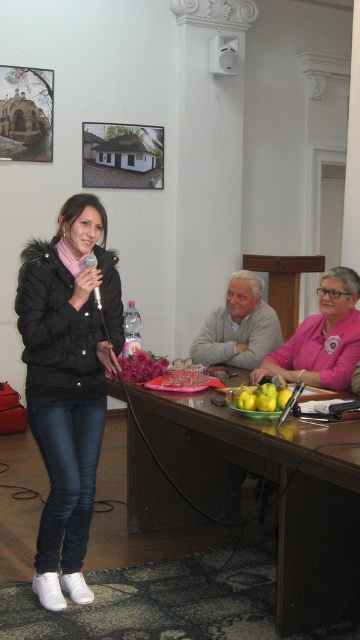
In the scene shown: Can you confirm if gray woolen sweater at center is positioned above white glossy speaker at upper center?

No.

Is point (261, 339) farther from camera compared to point (235, 36)?

No, it is in front of (235, 36).

Locate an element on the screen. The image size is (360, 640). gray woolen sweater at center is located at coordinates (239, 326).

Looking at this image, is pink fabric at center to the left of matte black microphone at center from the viewer's perspective?

No, pink fabric at center is not to the left of matte black microphone at center.

Is pink fabric at center shorter than matte black microphone at center?

In fact, pink fabric at center may be taller than matte black microphone at center.

Is point (315, 336) in front of point (97, 285)?

That is False.

I want to click on pink fabric at center, so click(321, 337).

Does brown wooden table at center lie behind white glossy speaker at upper center?

No.

Is brown wooden table at center thinner than white glossy speaker at upper center?

Incorrect, brown wooden table at center's width is not less than white glossy speaker at upper center's.

This screenshot has height=640, width=360. What do you see at coordinates (279, 490) in the screenshot?
I see `brown wooden table at center` at bounding box center [279, 490].

Locate an element on the screen. brown wooden table at center is located at coordinates (279, 490).